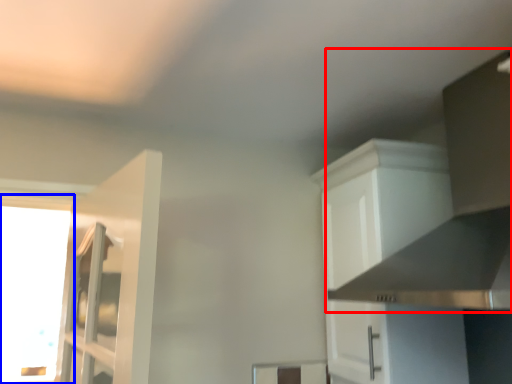
Question: Which object appears farthest to the camera in this image, vent (highlighted by a red box) or window (highlighted by a blue box)?

Choices:
 (A) vent
 (B) window

Answer: (B)